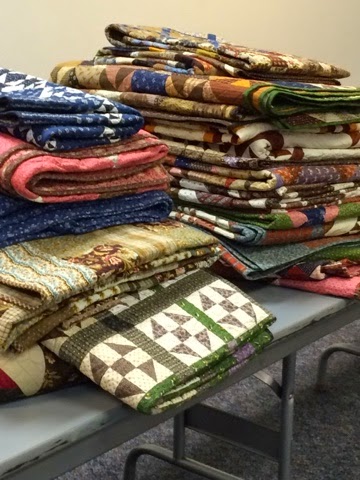
Locate an element on the screen. Image resolution: width=360 pixels, height=480 pixels. wall is located at coordinates (45, 41).